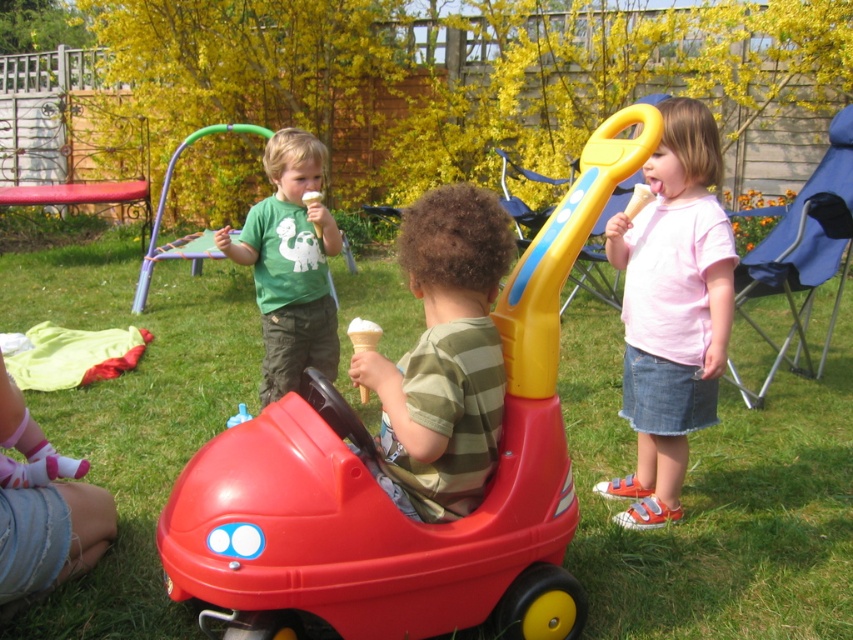
You are a parent trying to ensure all children are within a safe distance of each other for supervision. The two closest children are at point (x=309, y=438). Are they within a 2.5 meter safety radius?

The two closest children are at point (x=309, y=438) and are 2.08 meters apart, which is within the 2.5 meter safety radius.

You are a drone operator trying to capture aerial shots of the children in the backyard. You need to fly your drone from the point at coordinates point (426,339) to the point at coordinates point (379,333). Based on the scene description, will the drone have an unobstructed path between these two points?

Point (426,339) is in front of point (379,333), so the drone will have an unobstructed path between these two points since the first point is closer to the viewer and the second point is behind it.